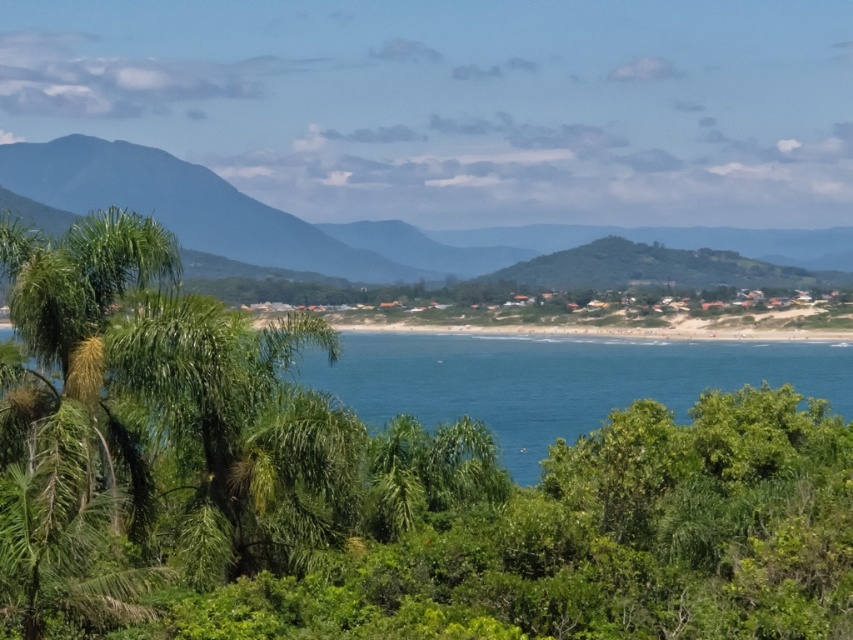
Question: Among these points, which one is farthest from the camera?

Choices:
 (A) (149, 188)
 (B) (780, 349)

Answer: (A)

Question: Can you confirm if blue water at center is thinner than green leafy mountain at center?

Choices:
 (A) yes
 (B) no

Answer: (A)

Question: Does blue water at center lie behind green leafy mountain at center?

Choices:
 (A) no
 (B) yes

Answer: (A)

Question: Which point is closer to the camera?

Choices:
 (A) blue water at center
 (B) green leafy mountain at center

Answer: (A)

Question: Does blue water at center appear on the left side of green leafy mountain at center?

Choices:
 (A) yes
 (B) no

Answer: (B)